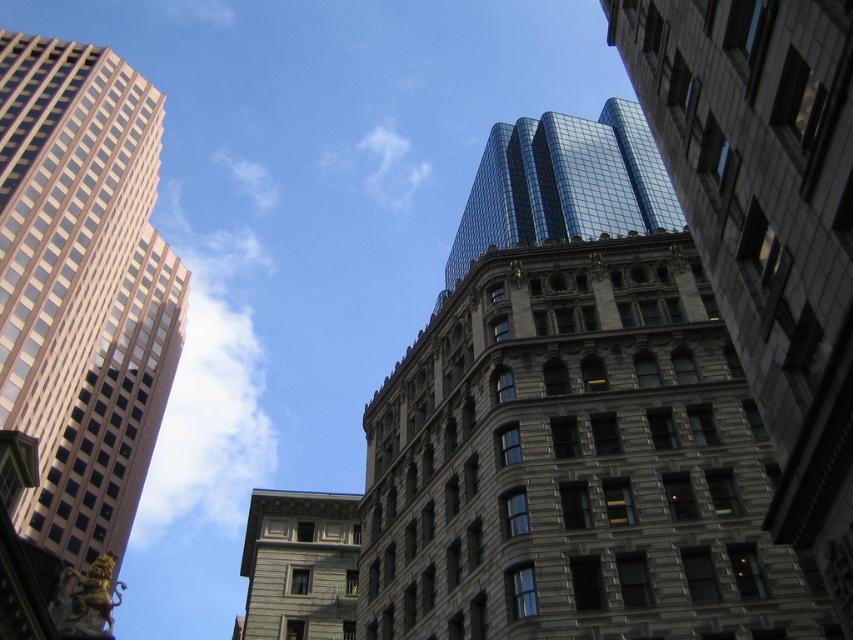
Question: Among these objects, which one is nearest to the camera?

Choices:
 (A) shiny glass skyscraper at upper center
 (B) gray stone building at center

Answer: (A)

Question: Is shiny glass skyscraper at upper center wider than gray stone building at center?

Choices:
 (A) no
 (B) yes

Answer: (A)

Question: Can you confirm if matte glass skyscraper at left is bigger than gray stone building at center?

Choices:
 (A) no
 (B) yes

Answer: (A)

Question: Is shiny glass skyscraper at upper center bigger than gray stone building at center?

Choices:
 (A) yes
 (B) no

Answer: (B)

Question: Which is farther from the matte glass skyscraper at left?

Choices:
 (A) gray stone building at center
 (B) shiny glass skyscraper at upper center

Answer: (B)

Question: Which object is closer to the camera taking this photo?

Choices:
 (A) matte glass skyscraper at left
 (B) shiny glass skyscraper at upper center
 (C) gray stone building at center

Answer: (B)